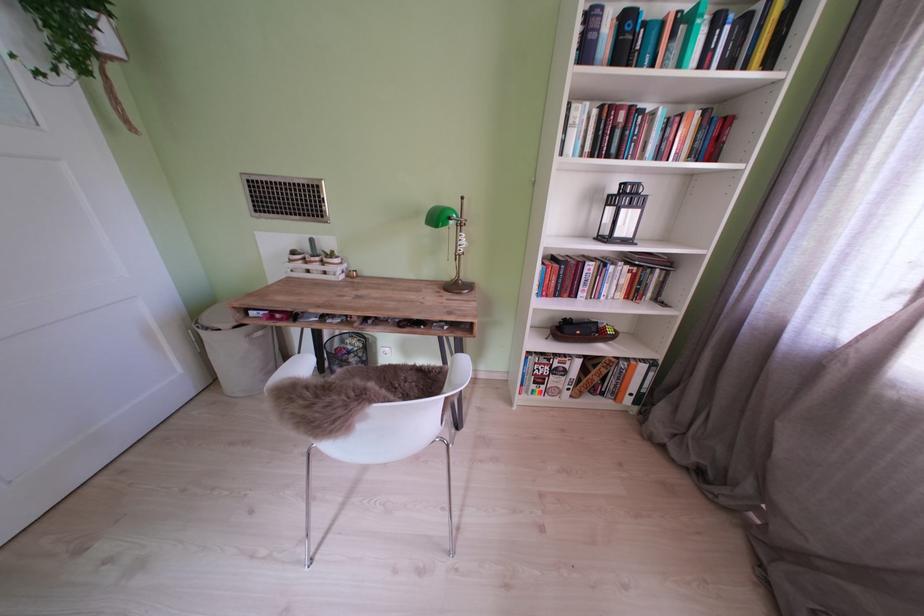
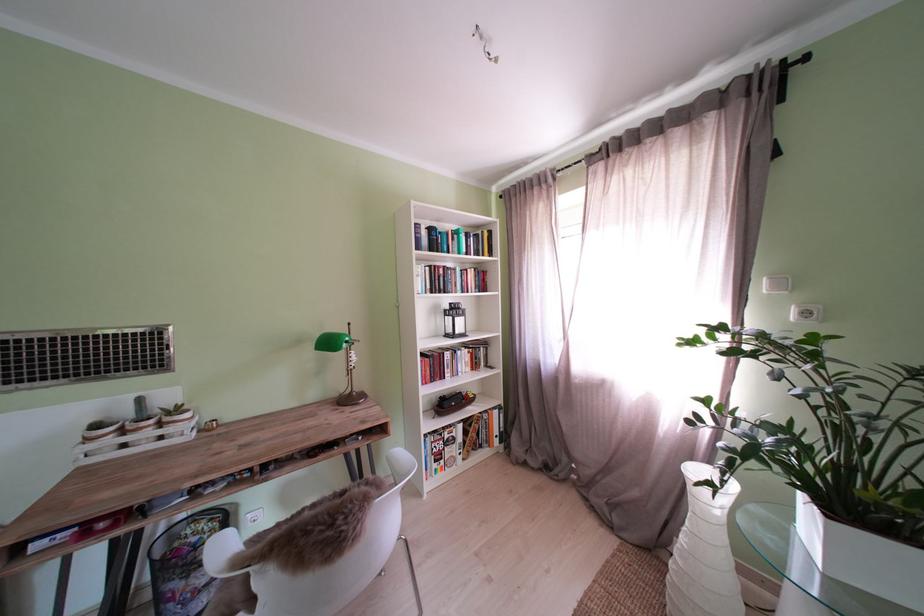
Find the pixel in the second image that matches pixel 540 359 in the first image.

(436, 440)